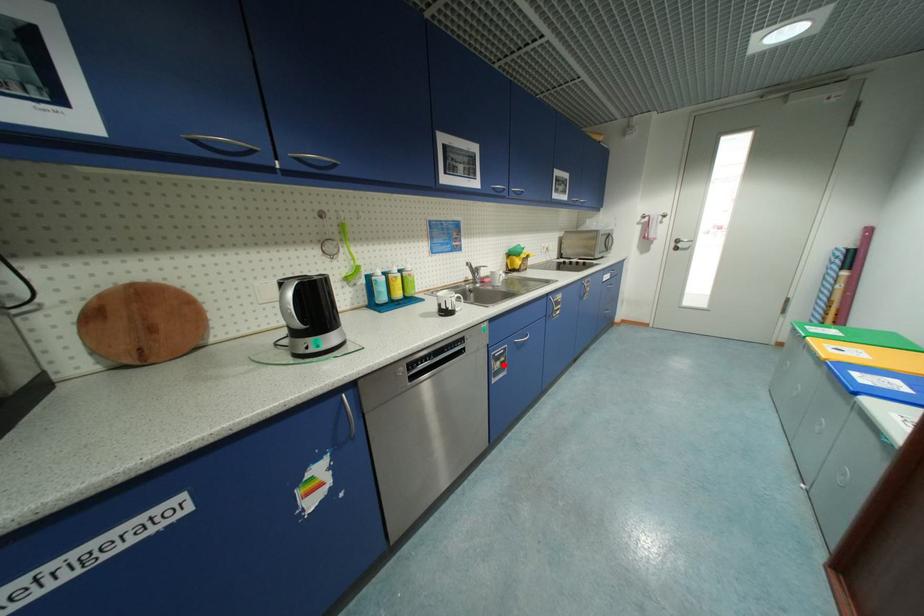
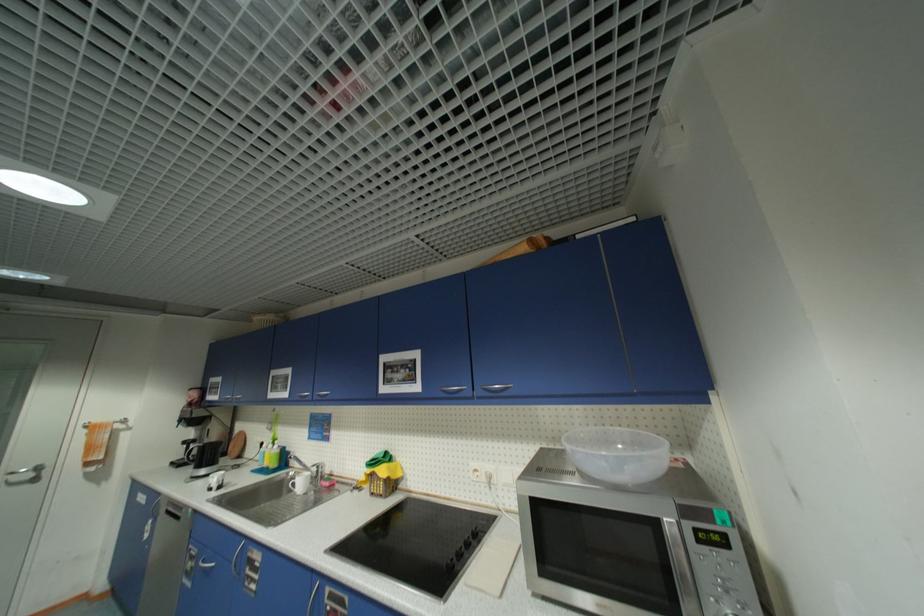
Question: I am providing you with two images of the same scene from different viewpoints. A red point is shown in image1. For the corresponding object point in image2, is it positioned nearer or farther from the camera?

Choices:
 (A) Nearer
 (B) Farther

Answer: (A)